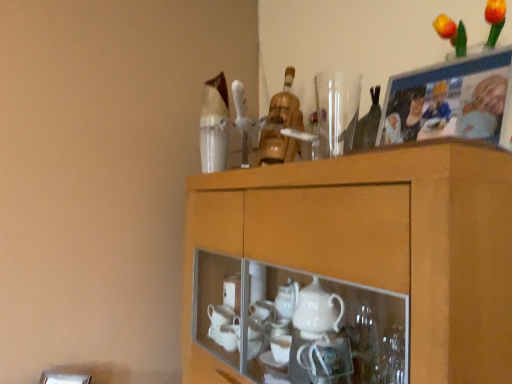
The width and height of the screenshot is (512, 384). What do you see at coordinates (354, 268) in the screenshot?
I see `wooden cabinet at upper center` at bounding box center [354, 268].

This screenshot has width=512, height=384. I want to click on transparent glass vase at upper center, so click(x=336, y=111).

The height and width of the screenshot is (384, 512). Find the location of `wooden cabinet at upper center`. wooden cabinet at upper center is located at coordinates (354, 268).

Can you confirm if transparent glass vase at upper center is wider than wooden photo frame at upper right?

Yes, transparent glass vase at upper center is wider than wooden photo frame at upper right.

Would you say transparent glass vase at upper center is outside wooden photo frame at upper right?

transparent glass vase at upper center lies outside wooden photo frame at upper right's area.

From a real-world perspective, who is located higher, transparent glass vase at upper center or wooden photo frame at upper right?

In real-world perspective, transparent glass vase at upper center is above.

Visually, is wooden photo frame at upper right positioned to the left or to the right of transparent glass vase at upper center?

wooden photo frame at upper right is positioned on transparent glass vase at upper center's right side.

Find the location of a particular element. The image size is (512, 384). picture frame below the transparent glass vase at upper center (from the image's perspective) is located at coordinates (451, 101).

Between wooden photo frame at upper right and transparent glass vase at upper center, which one has smaller width?

wooden photo frame at upper right.

What are the coordinates of `picture frame to the right of wooden cabinet at upper center` in the screenshot? It's located at (451, 101).

Would you say wooden cabinet at upper center is inside or outside wooden photo frame at upper right?

wooden cabinet at upper center is located beyond the bounds of wooden photo frame at upper right.

From the picture: Is wooden cabinet at upper center facing away from wooden photo frame at upper right?

That's not correct — wooden cabinet at upper center is not looking away from wooden photo frame at upper right.

Is wooden cabinet at upper center wider than wooden photo frame at upper right?

Yes.

Does wooden photo frame at upper right appear on the right side of wooden cabinet at upper center?

Yes, wooden photo frame at upper right is to the right of wooden cabinet at upper center.

Does wooden photo frame at upper right have a larger size compared to wooden cabinet at upper center?

Incorrect, wooden photo frame at upper right is not larger than wooden cabinet at upper center.

From the image's perspective, which is above, wooden photo frame at upper right or wooden cabinet at upper center?

wooden photo frame at upper right appears higher in the image.

Is wooden photo frame at upper right closer to camera compared to wooden cabinet at upper center?

No, it is not.

Would you say wooden cabinet at upper center is inside or outside transparent glass vase at upper center?

wooden cabinet at upper center exists outside the volume of transparent glass vase at upper center.

Does wooden cabinet at upper center come behind transparent glass vase at upper center?

No, wooden cabinet at upper center is closer to the viewer.

Looking at the image, does wooden cabinet at upper center seem bigger or smaller compared to transparent glass vase at upper center?

wooden cabinet at upper center is bigger than transparent glass vase at upper center.

From a real-world perspective, is transparent glass vase at upper center positioned above or below wooden cabinet at upper center?

Clearly, from a real-world perspective, transparent glass vase at upper center is above wooden cabinet at upper center.

Considering the sizes of transparent glass vase at upper center and wooden cabinet at upper center in the image, is transparent glass vase at upper center bigger or smaller than wooden cabinet at upper center?

Clearly, transparent glass vase at upper center is smaller in size than wooden cabinet at upper center.

Does point (330, 135) lie behind point (258, 353)?

Yes, point (330, 135) is behind point (258, 353).

Is transparent glass vase at upper center oriented towards wooden cabinet at upper center?

No, transparent glass vase at upper center is not oriented towards wooden cabinet at upper center.

There is a wooden photo frame at upper right. Identify the location of tableware above it (from a real-world perspective). This screenshot has width=512, height=384. (336, 111).

Find the location of a particular element. This screenshot has width=512, height=384. picture frame in front of the transparent glass vase at upper center is located at coordinates (451, 101).

Looking at the image, which one is located further to wooden cabinet at upper center, wooden photo frame at upper right or transparent glass vase at upper center?

transparent glass vase at upper center.

From the image, which object appears to be nearer to transparent glass vase at upper center, wooden cabinet at upper center or wooden photo frame at upper right?

Based on the image, wooden photo frame at upper right appears to be nearer to transparent glass vase at upper center.

Considering their positions, is wooden photo frame at upper right positioned closer to transparent glass vase at upper center than wooden cabinet at upper center?

The object closer to transparent glass vase at upper center is wooden photo frame at upper right.

Consider the image. When comparing their distances from wooden photo frame at upper right, does transparent glass vase at upper center or wooden cabinet at upper center seem closer?

Based on the image, transparent glass vase at upper center appears to be nearer to wooden photo frame at upper right.

Looking at the image, which one is located further to wooden cabinet at upper center, transparent glass vase at upper center or wooden photo frame at upper right?

transparent glass vase at upper center lies further to wooden cabinet at upper center than the other object.

Based on their spatial positions, is wooden cabinet at upper center or transparent glass vase at upper center further from wooden photo frame at upper right?

The object further to wooden photo frame at upper right is wooden cabinet at upper center.

Identify the location of picture frame located between wooden cabinet at upper center and transparent glass vase at upper center in the depth direction. (451, 101).